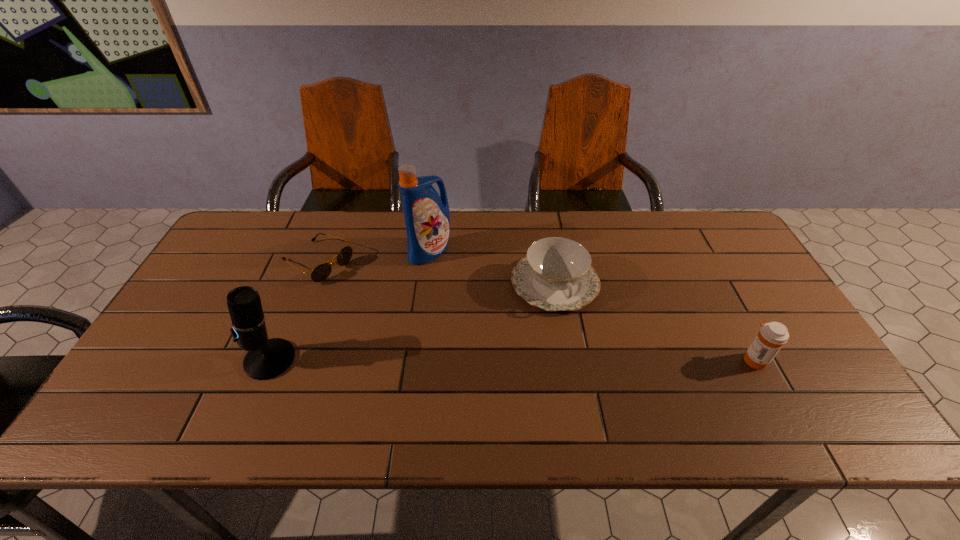
At what (x,y) coordinates should I click in order to perform the action: click on free space between the second shortest object and the rightmost object. Please return your answer as a coordinate pair (x, y). This screenshot has width=960, height=540. Looking at the image, I should click on (655, 321).

Where is `vacant space that is in between the fourth object from left to right and the third object from right to left`? vacant space that is in between the fourth object from left to right and the third object from right to left is located at coordinates (492, 267).

Identify the location of free space between the second tallest object and the shortest object. This screenshot has height=540, width=960. (294, 311).

Choose which object is the fourth nearest neighbor to the fourth shortest object. Please provide its 2D coordinates. Your answer should be formatted as a tuple, i.e. [(x, y)], where the tuple contains the x and y coordinates of a point satisfying the conditions above.

[(772, 336)]

Point out which object is positioned as the nearest to the rightmost object. Please provide its 2D coordinates. Your answer should be formatted as a tuple, i.e. [(x, y)], where the tuple contains the x and y coordinates of a point satisfying the conditions above.

[(556, 274)]

The width and height of the screenshot is (960, 540). In order to click on free space that satisfies the following two spatial constraints: 1. on the front side of the rightmost object; 2. on the left side of the microphone in this screenshot , I will do `click(270, 360)`.

You are a GUI agent. You are given a task and a screenshot of the screen. Output one action in this format:
    pyautogui.click(x=<x>, y=<y>)
    Task: Click on the free space that satisfies the following two spatial constraints: 1. on the front side of the fourth tallest object; 2. on the right side of the third object from right to left
    This screenshot has height=540, width=960.
    Given the screenshot: What is the action you would take?
    pyautogui.click(x=426, y=284)